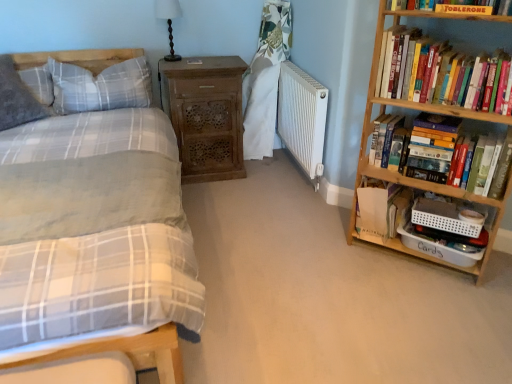
Question: Is hardcover books at upper right, positioned as the first book in top-to-bottom order, shorter than white matte radiator at center?

Choices:
 (A) no
 (B) yes

Answer: (B)

Question: Is white matte radiator at center surrounded by hardcover books at upper right, positioned as the first book in top-to-bottom order?

Choices:
 (A) yes
 (B) no

Answer: (B)

Question: Considering the relative positions of hardcover books at upper right, positioned as the first book in top-to-bottom order, and white matte radiator at center in the image provided, is hardcover books at upper right, positioned as the first book in top-to-bottom order, behind white matte radiator at center?

Choices:
 (A) yes
 (B) no

Answer: (B)

Question: Considering the relative sizes of hardcover books at upper right, marked as the third book in a bottom-to-top arrangement, and white matte radiator at center in the image provided, is hardcover books at upper right, marked as the third book in a bottom-to-top arrangement, wider than white matte radiator at center?

Choices:
 (A) no
 (B) yes

Answer: (B)

Question: Considering the relative positions of hardcover books at upper right, marked as the third book in a bottom-to-top arrangement, and white matte radiator at center in the image provided, is hardcover books at upper right, marked as the third book in a bottom-to-top arrangement, to the left of white matte radiator at center from the viewer's perspective?

Choices:
 (A) yes
 (B) no

Answer: (B)

Question: From the image's perspective, is hardcover books at upper right, positioned as the first book in top-to-bottom order, above white matte radiator at center?

Choices:
 (A) yes
 (B) no

Answer: (A)

Question: From the image's perspective, is white matte radiator at center under white paper bag at right, which ranks as the 1th book in bottom-to-top order?

Choices:
 (A) yes
 (B) no

Answer: (B)

Question: Is white matte radiator at center outside of white paper bag at right, which ranks as the 1th book in bottom-to-top order?

Choices:
 (A) yes
 (B) no

Answer: (A)

Question: Does white matte radiator at center have a greater width compared to white paper bag at right, which is counted as the third book, starting from the top?

Choices:
 (A) yes
 (B) no

Answer: (B)

Question: Is white matte radiator at center smaller than white paper bag at right, which is counted as the third book, starting from the top?

Choices:
 (A) yes
 (B) no

Answer: (B)

Question: Does white matte radiator at center come in front of white paper bag at right, which ranks as the 1th book in bottom-to-top order?

Choices:
 (A) yes
 (B) no

Answer: (B)

Question: Is white matte radiator at center looking in the opposite direction of white paper bag at right, which ranks as the 1th book in bottom-to-top order?

Choices:
 (A) yes
 (B) no

Answer: (B)

Question: From the image's perspective, is gray plaid pillow at upper left, marked as the first pillow in a right-to-left arrangement, on matte plaid bed at left?

Choices:
 (A) yes
 (B) no

Answer: (A)